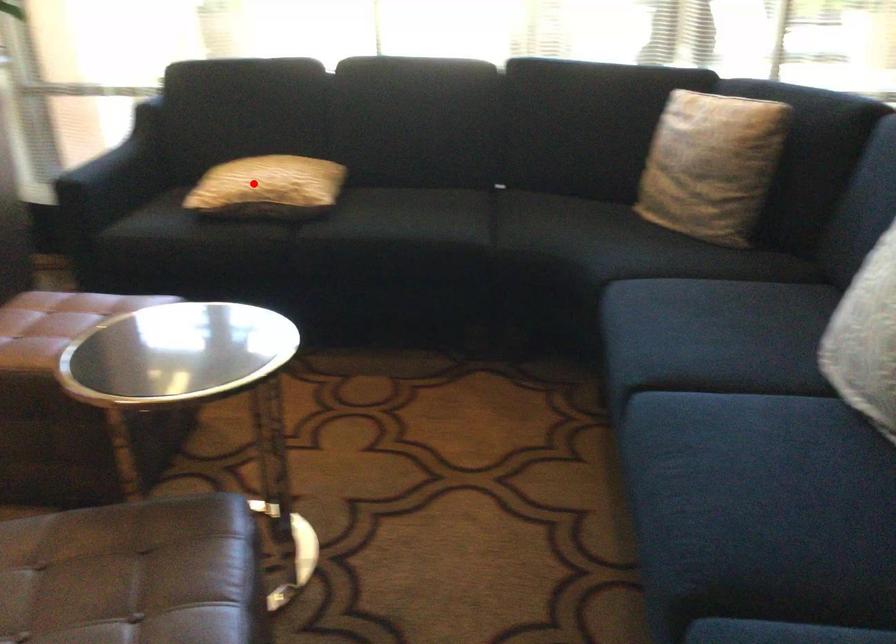
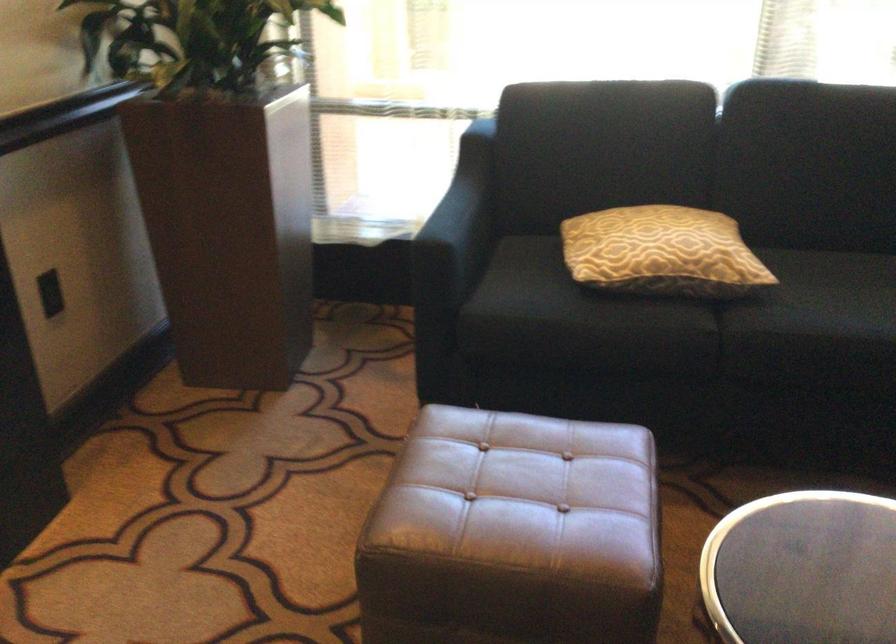
Question: I am providing you with two images of the same scene from different viewpoints. In image1, a red point is highlighted. Considering the same 3D point in image2, which of the following is correct?

Choices:
 (A) It is closer
 (B) It is farther

Answer: (A)